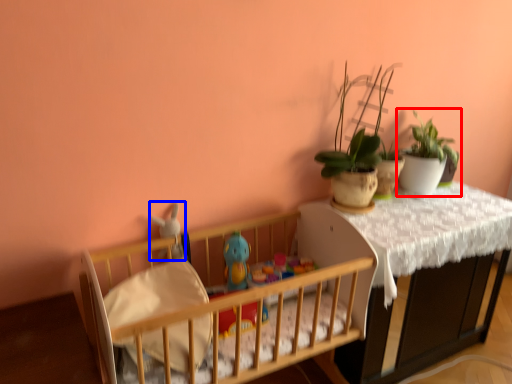
Question: Among these objects, which one is nearest to the camera, houseplant (highlighted by a red box) or toy (highlighted by a blue box)?

Choices:
 (A) houseplant
 (B) toy

Answer: (B)